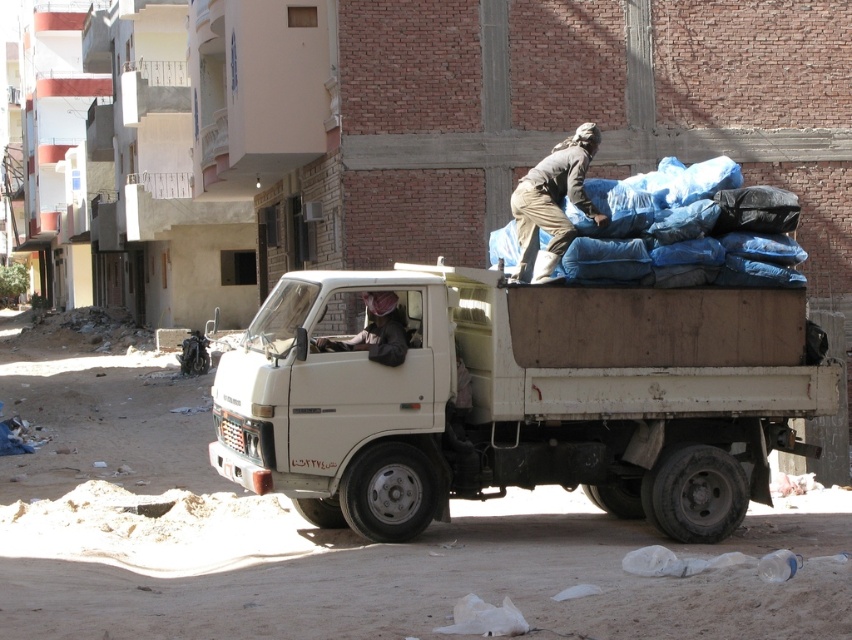
Is point (525, 280) closer to camera compared to point (384, 339)?

No, (525, 280) is further to viewer.

Is dark brown fabric at upper right wider than brown leather jacket at center?

Incorrect, dark brown fabric at upper right's width does not surpass brown leather jacket at center's.

Find the location of `dark brown fabric at upper right`. dark brown fabric at upper right is located at coordinates (553, 202).

Measure the distance between point (x=676, y=353) and camera.

Point (x=676, y=353) and camera are 37.31 feet apart.

Does point (607, 412) come behind point (513, 216)?

No, (607, 412) is in front of (513, 216).

Locate an element on the screen. The width and height of the screenshot is (852, 640). white matte truck at center is located at coordinates (517, 397).

Which is behind, point (576, 218) or point (401, 353)?

The point (576, 218) is more distant.

Based on the photo, measure the distance between point (660, 204) and camera.

Point (660, 204) and camera are 38.14 feet apart.

At what (x,y) coordinates should I click in order to perform the action: click on blue tarpaulin bags at upper right. Please return your answer as a coordinate pair (x, y). Looking at the image, I should click on (649, 216).